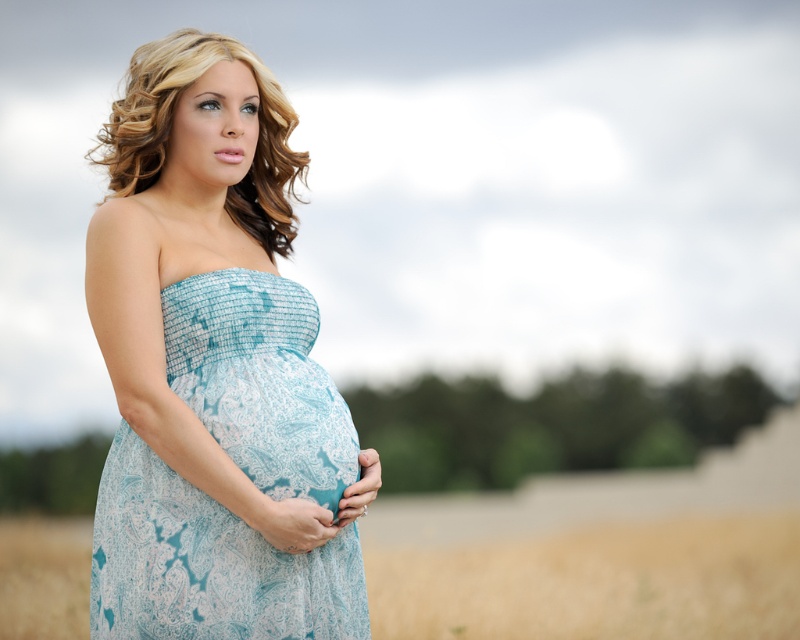
Question: Is light blue lace dress at center below golden wheat field at lower center?

Choices:
 (A) yes
 (B) no

Answer: (B)

Question: Which point is farther from the camera taking this photo?

Choices:
 (A) (502, 621)
 (B) (196, 548)

Answer: (A)

Question: Among these objects, which one is farthest from the camera?

Choices:
 (A) golden wheat field at lower center
 (B) light blue lace dress at center

Answer: (A)

Question: Where is light blue lace dress at center located in relation to golden wheat field at lower center in the image?

Choices:
 (A) below
 (B) above

Answer: (B)

Question: Can you confirm if light blue lace dress at center is wider than golden wheat field at lower center?

Choices:
 (A) no
 (B) yes

Answer: (B)